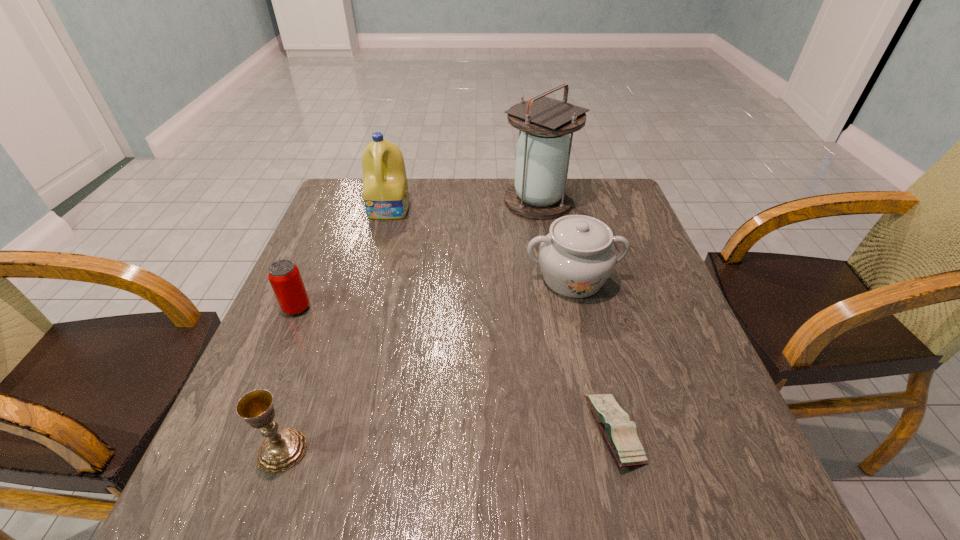
In order to click on free spot between the diary and the chinaware in this screenshot , I will do `click(593, 355)`.

Find the location of a particular element. Image resolution: width=960 pixels, height=540 pixels. unoccupied area between the tallest object and the fifth tallest object is located at coordinates (418, 254).

In order to click on free area in between the chalice and the fifth tallest object in this screenshot , I will do click(290, 379).

Find the location of a particular element. free space between the lantern and the detergent is located at coordinates (464, 205).

At what (x,y) coordinates should I click in order to perform the action: click on free point between the detergent and the chalice. Please return your answer as a coordinate pair (x, y). The image size is (960, 540). Looking at the image, I should click on (336, 329).

The width and height of the screenshot is (960, 540). In order to click on free spot between the diary and the chalice in this screenshot , I will do `click(448, 441)`.

Find the location of a particular element. vacant space that is in between the chalice and the second tallest object is located at coordinates (336, 329).

Where is `vacant space that is in between the second shortest object and the chinaware`? vacant space that is in between the second shortest object and the chinaware is located at coordinates (435, 293).

Where is `vacant point located between the chinaware and the diary`? vacant point located between the chinaware and the diary is located at coordinates (593, 355).

Locate an element on the screen. This screenshot has width=960, height=540. free point between the leftmost object and the chalice is located at coordinates (290, 379).